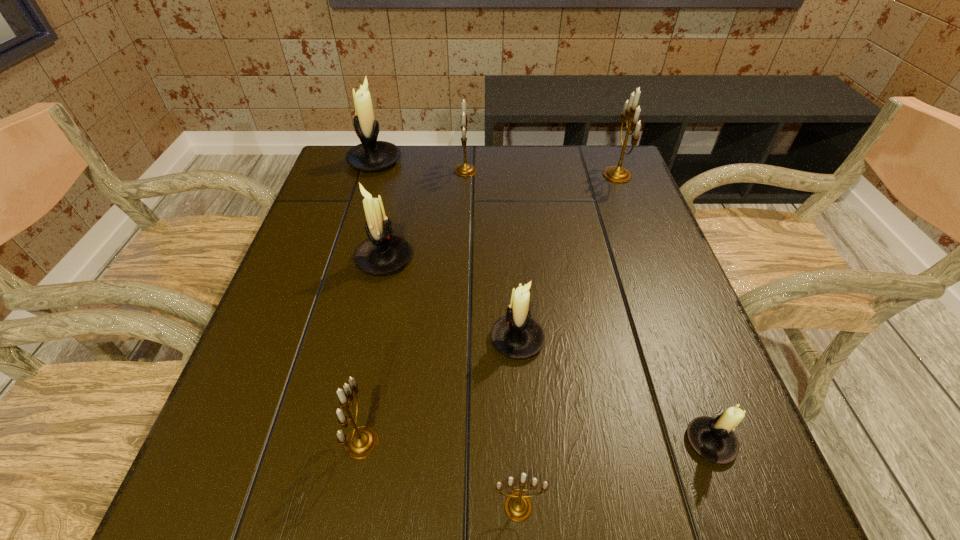
Choose which candelabrum is the seventh nearest neighbor to the nearest object. Please provide its 2D coordinates. Your answer should be formatted as a tuple, i.e. [(x, y)], where the tuple contains the x and y coordinates of a point satisfying the conditions above.

[(370, 155)]

Select which candelabrum is the fourth closest to the rightmost gold candelabrum. Please provide its 2D coordinates. Your answer should be formatted as a tuple, i.e. [(x, y)], where the tuple contains the x and y coordinates of a point satisfying the conditions above.

[(370, 155)]

I want to click on white candle holder that can be found as the second closest to the second farthest white candle holder, so click(x=370, y=155).

The width and height of the screenshot is (960, 540). What are the coordinates of `white candle holder that is the closest to the fifth farthest object` in the screenshot? It's located at [382, 253].

Locate which gold candelabrum ranks in proximity to the fifth farthest object. Please provide its 2D coordinates. Your answer should be formatted as a tuple, i.e. [(x, y)], where the tuple contains the x and y coordinates of a point satisfying the conditions above.

[(361, 442)]

Locate which gold candelabrum ranks second in proximity to the rightmost white candle holder. Please provide its 2D coordinates. Your answer should be formatted as a tuple, i.e. [(x, y)], where the tuple contains the x and y coordinates of a point satisfying the conditions above.

[(361, 442)]

In order to click on vacant point that satisfies the following two spatial constraints: 1. on the back side of the fifth object from right to left; 2. on the right side of the third biggest gold candelabrum in this screenshot , I will do `click(414, 170)`.